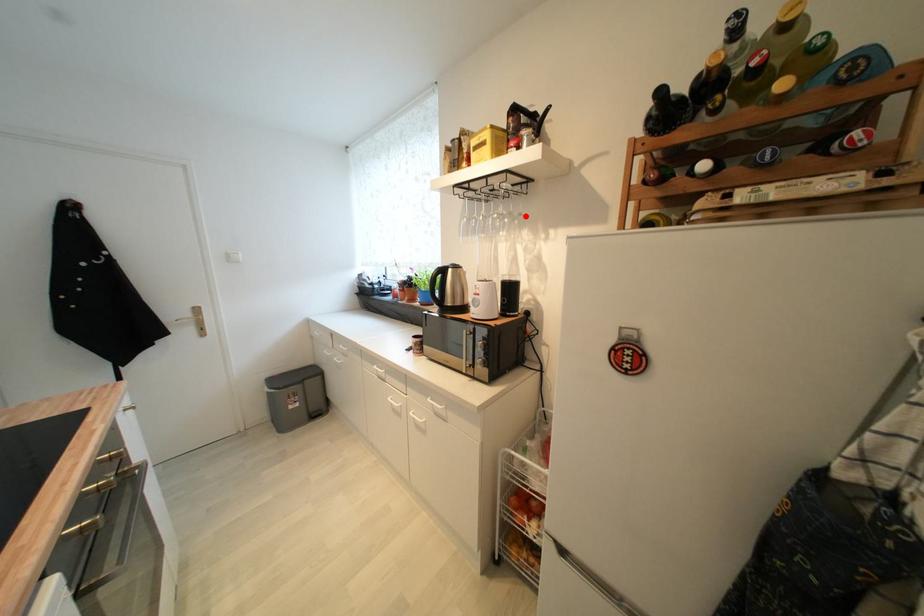
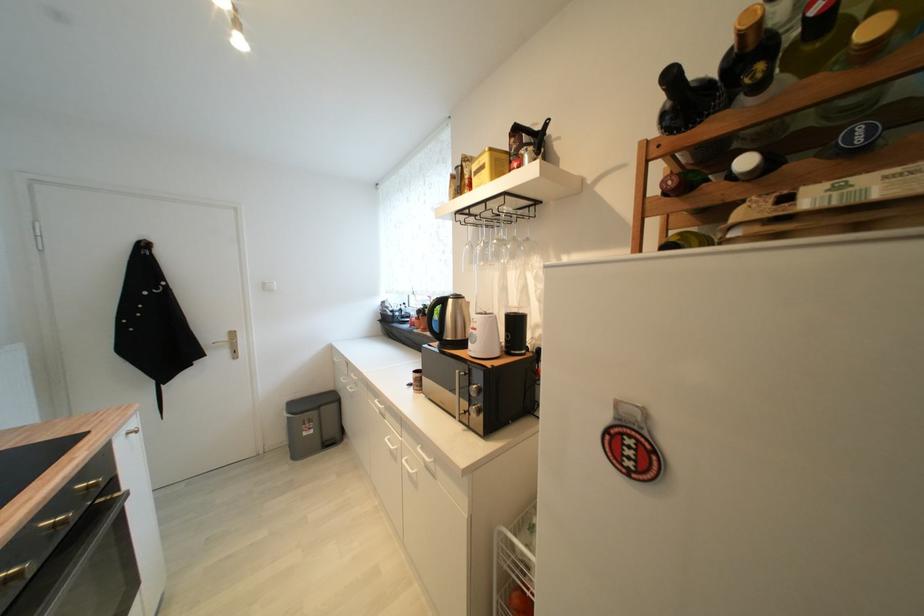
Where in the second image is the point corresponding to the highlighted location from the first image?

(532, 241)